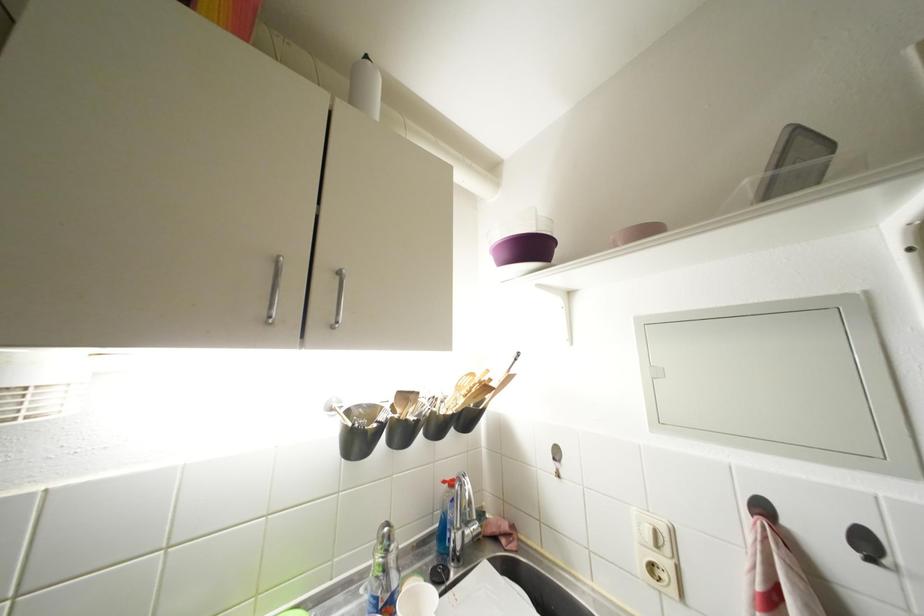
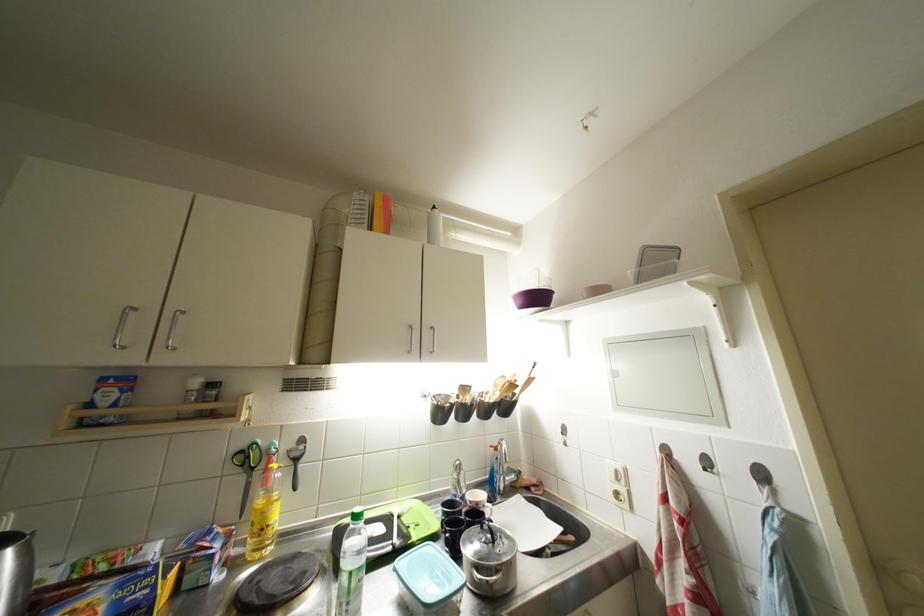
Question: The first image is from the beginning of the video and the second image is from the end. How did the camera likely rotate when shooting the video?

Choices:
 (A) Left
 (B) Right
 (C) Up
 (D) Down

Answer: (A)